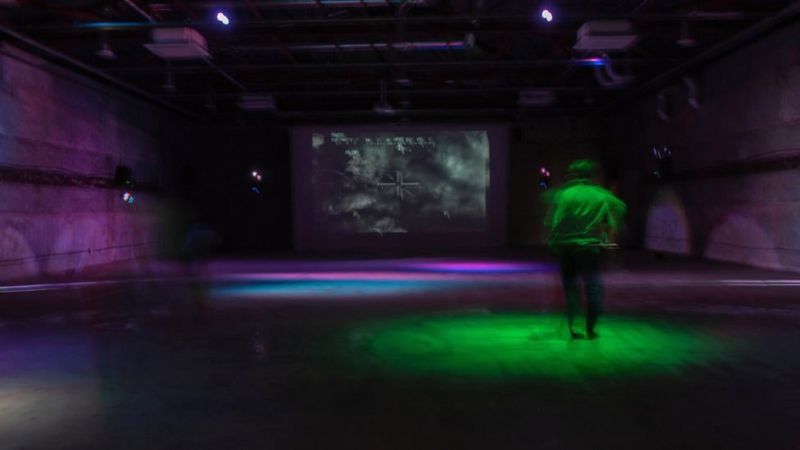
Where is `screen`? screen is located at coordinates (436, 196).